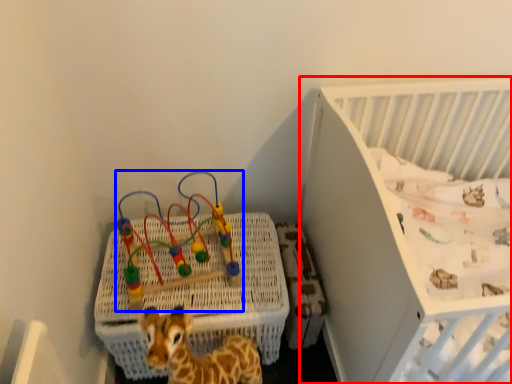
Question: Which point is further to the camera, infant bed (highlighted by a red box) or toy (highlighted by a blue box)?

Choices:
 (A) infant bed
 (B) toy

Answer: (B)